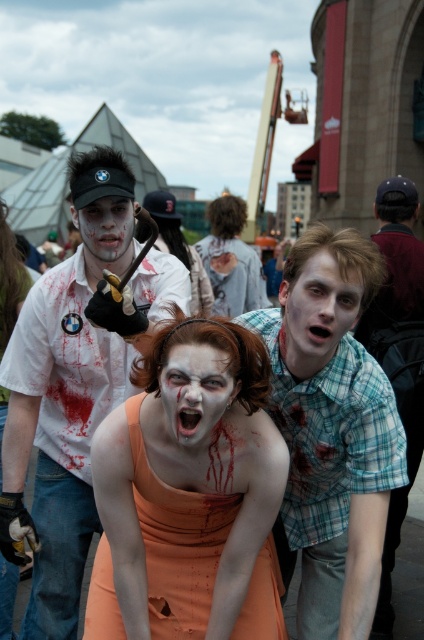
Can you confirm if checkered fabric shirt at center is shorter than matte skin face at center?

No.

Who is higher up, checkered fabric shirt at center or matte skin face at center?

matte skin face at center is higher up.

Who is more forward, (312, 524) or (307, 301)?

Point (307, 301)

Where is `checkered fabric shirt at center`? checkered fabric shirt at center is located at coordinates (331, 432).

Looking at this image, is matte skin face at center positioned behind matte white face at center?

No, matte skin face at center is in front of matte white face at center.

Which is more to the right, matte skin face at center or matte white face at center?

Positioned to the right is matte skin face at center.

Between point (315, 294) and point (125, 218), which one is positioned behind?

Point (125, 218)

The height and width of the screenshot is (640, 424). Find the location of `matte skin face at center`. matte skin face at center is located at coordinates (317, 310).

Is orange fabric dress at center positioned behind blue plaid shirt at center?

No, it is in front of blue plaid shirt at center.

Is orange fabric dress at center thinner than blue plaid shirt at center?

Incorrect, orange fabric dress at center's width is not less than blue plaid shirt at center's.

The image size is (424, 640). What are the coordinates of `orange fabric dress at center` in the screenshot? It's located at (189, 493).

Identify the location of orange fabric dress at center. This screenshot has width=424, height=640. (189, 493).